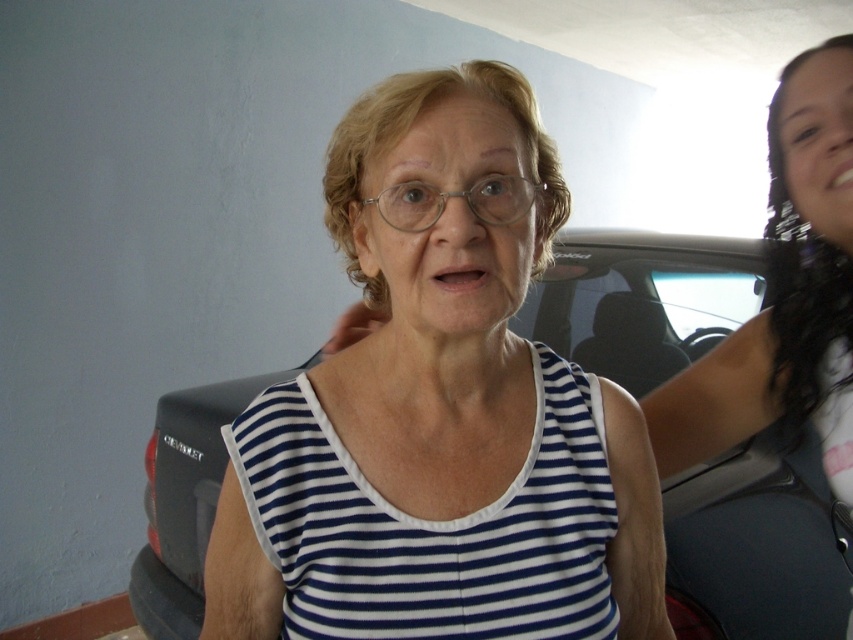
Question: Among these points, which one is nearest to the camera?

Choices:
 (A) (712, 481)
 (B) (239, 419)

Answer: (B)

Question: Is metallic gray car at center further to camera compared to blue and white striped tank top at center?

Choices:
 (A) no
 (B) yes

Answer: (B)

Question: Is metallic gray car at center to the left of blue and white striped tank top at center from the viewer's perspective?

Choices:
 (A) no
 (B) yes

Answer: (B)

Question: Which point is closer to the camera?

Choices:
 (A) blue and white striped tank top at center
 (B) metallic gray car at center

Answer: (A)

Question: Which object is the closest to the metallic gray car at center?

Choices:
 (A) blue and white striped tank top at center
 (B) white striped tank top at center

Answer: (B)

Question: Is metallic gray car at center thinner than white striped tank top at center?

Choices:
 (A) yes
 (B) no

Answer: (B)